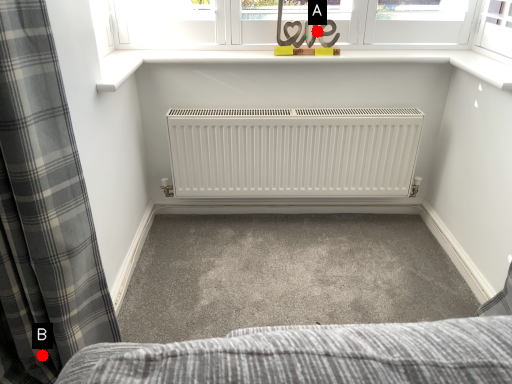
Question: Two points are circled on the image, labeled by A and B beside each circle. Which point is closer to the camera?

Choices:
 (A) A is closer
 (B) B is closer

Answer: (B)